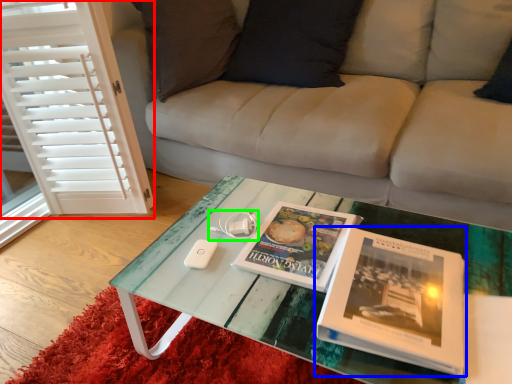
Question: Based on their relative distances, which object is nearer to screen door (highlighted by a red box)? Choose from book (highlighted by a blue box) and game controller (highlighted by a green box).

Choices:
 (A) book
 (B) game controller

Answer: (B)